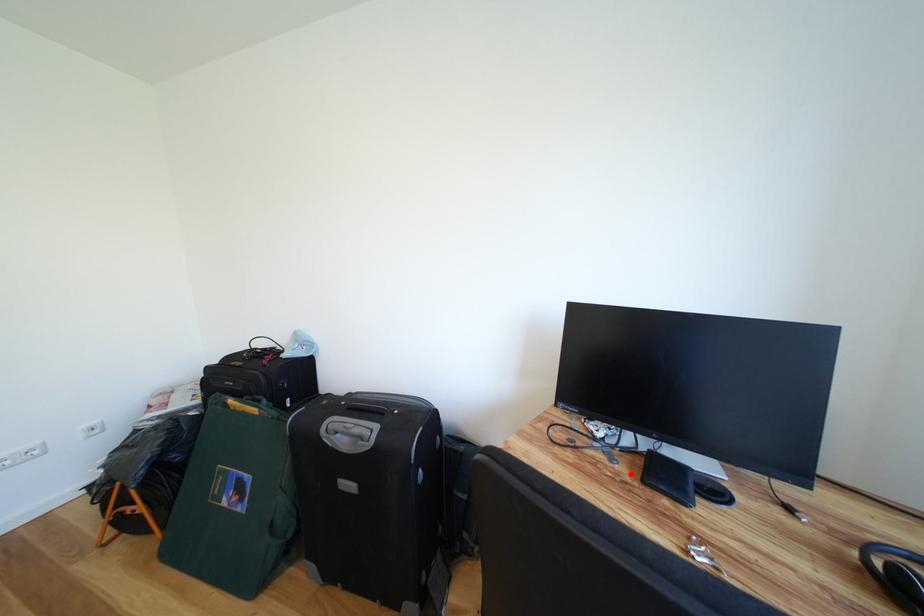
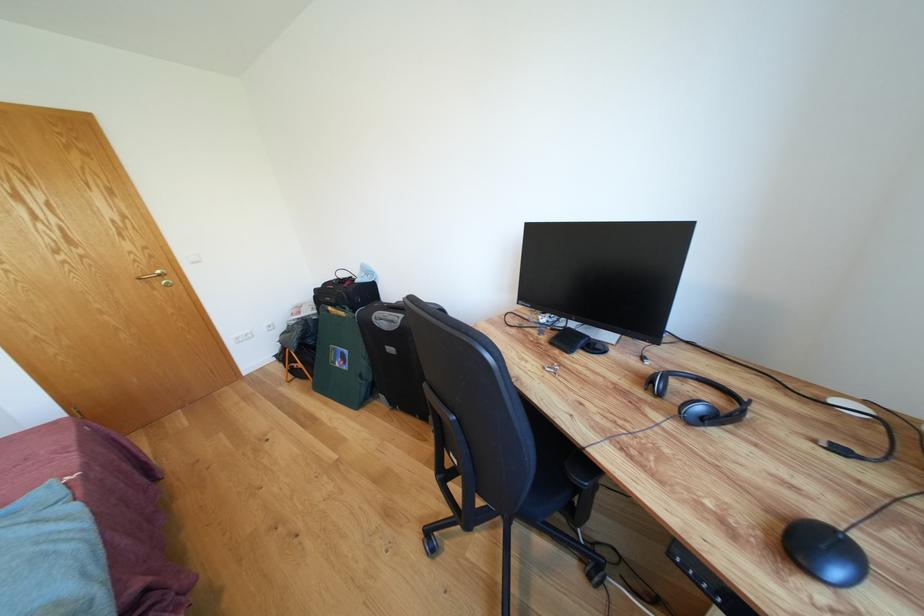
Find the pixel in the second image that matches the highlighted location in the first image.

(553, 342)